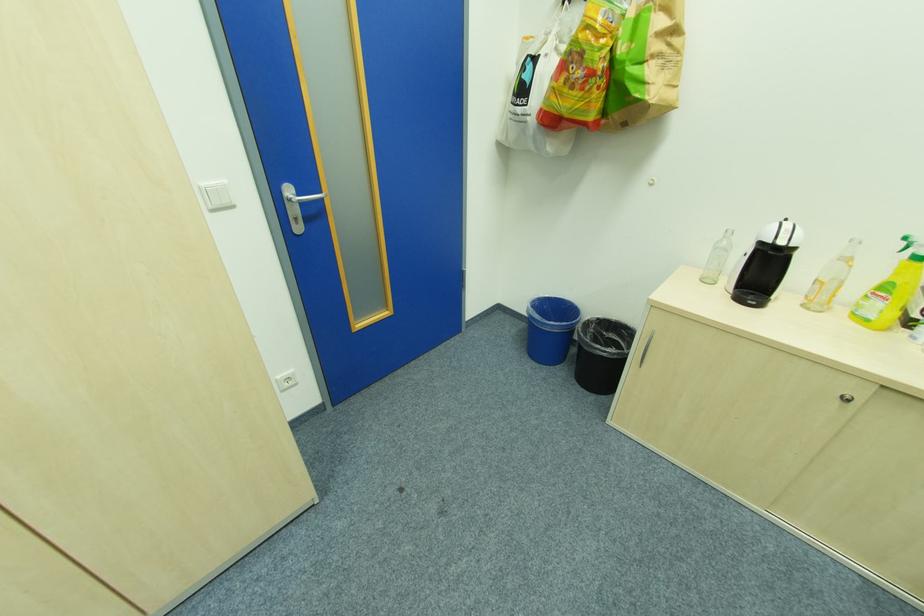
Locate an element on the screen. The image size is (924, 616). yellow spray bottle is located at coordinates (831, 278).